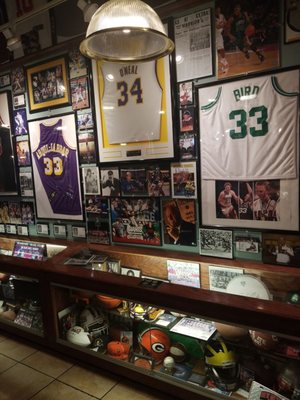
Locate an element on the screen. grout is located at coordinates (20, 362), (42, 373), (42, 388), (64, 373), (76, 389), (106, 392), (8, 357), (8, 367), (27, 357).